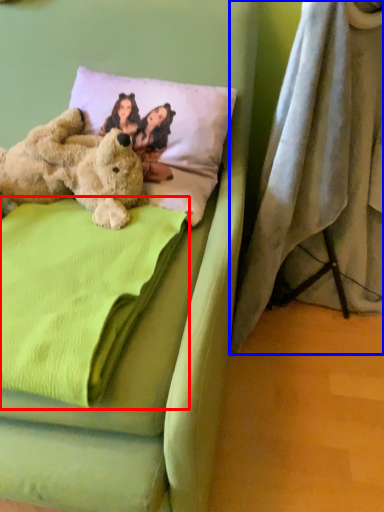
Question: Which point is further to the camera, blanket (highlighted by a red box) or curtain (highlighted by a blue box)?

Choices:
 (A) blanket
 (B) curtain

Answer: (B)